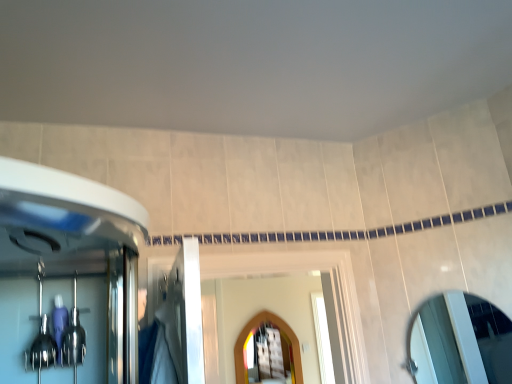
At what (x,y) coordinates should I click in order to perform the action: click on wooden arched mirror at center, arranged as the first mirror when viewed from the back. Please return your answer as a coordinate pair (x, y). The image size is (512, 384). Looking at the image, I should click on (255, 329).

What is the approximate height of wooden arched mirror at center, the 1th mirror viewed from the left?

The height of wooden arched mirror at center, the 1th mirror viewed from the left, is 87.25 centimeters.

The image size is (512, 384). What do you see at coordinates (255, 329) in the screenshot? I see `wooden arched mirror at center, which appears as the first mirror when ordered from the bottom` at bounding box center [255, 329].

In order to face silver metallic mirror at right, the 2th mirror viewed from the left, should I rotate leftwards or rightwards?

You should look right and rotate roughly 25.393 degrees.

Find the location of `silver metallic mirror at right, the 1th mirror in the front-to-back sequence`. silver metallic mirror at right, the 1th mirror in the front-to-back sequence is located at coordinates (460, 342).

What is the approximate width of silver metallic mirror at right, which is the 1th mirror in top-to-bottom order?

The width of silver metallic mirror at right, which is the 1th mirror in top-to-bottom order, is 3.56 inches.

Describe the element at coordinates (460, 342) in the screenshot. I see `silver metallic mirror at right, marked as the second mirror in a back-to-front arrangement` at that location.

Where is `wooden arched mirror at center, which is the second mirror from front to back`? wooden arched mirror at center, which is the second mirror from front to back is located at coordinates (255, 329).

Looking at this image, is silver metallic mirror at right, the 2th mirror viewed from the left, to the right of wooden arched mirror at center, the second mirror from the top, from the viewer's perspective?

Indeed, silver metallic mirror at right, the 2th mirror viewed from the left, is positioned on the right side of wooden arched mirror at center, the second mirror from the top.

Is the depth of silver metallic mirror at right, which ranks as the 2th mirror in bottom-to-top order, greater than that of wooden arched mirror at center, the 2th mirror from the right?

No, silver metallic mirror at right, which ranks as the 2th mirror in bottom-to-top order, is closer to the camera.

Does point (422, 356) appear closer or farther from the camera than point (247, 335)?

Clearly, point (422, 356) is closer to the camera than point (247, 335).

From the image's perspective, who appears lower, silver metallic mirror at right, marked as the second mirror in a back-to-front arrangement, or wooden arched mirror at center, the second mirror from the top?

wooden arched mirror at center, the second mirror from the top, appears lower in the image.

From a real-world perspective, is silver metallic mirror at right, which ranks as the 2th mirror in bottom-to-top order, above or below wooden arched mirror at center, which appears as the first mirror when ordered from the bottom?

Clearly, from a real-world perspective, silver metallic mirror at right, which ranks as the 2th mirror in bottom-to-top order, is above wooden arched mirror at center, which appears as the first mirror when ordered from the bottom.

Can you confirm if silver metallic mirror at right, the 1th mirror in the front-to-back sequence, is wider than wooden arched mirror at center, the 1th mirror viewed from the left?

Indeed, silver metallic mirror at right, the 1th mirror in the front-to-back sequence, has a greater width compared to wooden arched mirror at center, the 1th mirror viewed from the left.

Does silver metallic mirror at right, the 2th mirror viewed from the left, have a greater height compared to wooden arched mirror at center, the second mirror from the top?

No.

In terms of size, does silver metallic mirror at right, the 1th mirror in the front-to-back sequence, appear bigger or smaller than wooden arched mirror at center, the 1th mirror viewed from the left?

Clearly, silver metallic mirror at right, the 1th mirror in the front-to-back sequence, is smaller in size than wooden arched mirror at center, the 1th mirror viewed from the left.

Is silver metallic mirror at right, which ranks as the 2th mirror in bottom-to-top order, completely or partially outside of wooden arched mirror at center, the second mirror from the top?

Indeed, silver metallic mirror at right, which ranks as the 2th mirror in bottom-to-top order, is completely outside wooden arched mirror at center, the second mirror from the top.

Is silver metallic mirror at right, which is the 1th mirror in top-to-bottom order, placed right next to wooden arched mirror at center, which appears as the first mirror when ordered from the bottom?

No, silver metallic mirror at right, which is the 1th mirror in top-to-bottom order, is not making contact with wooden arched mirror at center, which appears as the first mirror when ordered from the bottom.

Is silver metallic mirror at right, marked as the second mirror in a back-to-front arrangement, oriented away from wooden arched mirror at center, arranged as the first mirror when viewed from the back?

No, wooden arched mirror at center, arranged as the first mirror when viewed from the back, is not at the back of silver metallic mirror at right, marked as the second mirror in a back-to-front arrangement.

What's the angular difference between silver metallic mirror at right, acting as the first mirror starting from the right, and wooden arched mirror at center, which appears as the first mirror when ordered from the bottom,'s facing directions?

The facing directions of silver metallic mirror at right, acting as the first mirror starting from the right, and wooden arched mirror at center, which appears as the first mirror when ordered from the bottom, are 55.3 degrees apart.

Where is `mirror that appears below the silver metallic mirror at right, the 1th mirror in the front-to-back sequence (from a real-world perspective)`? mirror that appears below the silver metallic mirror at right, the 1th mirror in the front-to-back sequence (from a real-world perspective) is located at coordinates (255, 329).

Which is more to the left, wooden arched mirror at center, the 2th mirror from the right, or silver metallic mirror at right, which is the 1th mirror in top-to-bottom order?

Positioned to the left is wooden arched mirror at center, the 2th mirror from the right.

Is wooden arched mirror at center, arranged as the first mirror when viewed from the back, in front of or behind silver metallic mirror at right, which ranks as the 2th mirror in bottom-to-top order, in the image?

wooden arched mirror at center, arranged as the first mirror when viewed from the back, is behind silver metallic mirror at right, which ranks as the 2th mirror in bottom-to-top order.

Is point (286, 325) positioned before point (483, 331)?

That is False.

In the scene shown: From the image's perspective, between wooden arched mirror at center, the 1th mirror viewed from the left, and silver metallic mirror at right, marked as the second mirror in a back-to-front arrangement, who is located below?

wooden arched mirror at center, the 1th mirror viewed from the left, appears lower in the image.

From a real-world perspective, between wooden arched mirror at center, the 2th mirror from the right, and silver metallic mirror at right, marked as the second mirror in a back-to-front arrangement, who is vertically higher?

silver metallic mirror at right, marked as the second mirror in a back-to-front arrangement.

Which object is wider, wooden arched mirror at center, which is the second mirror from front to back, or silver metallic mirror at right, which ranks as the 2th mirror in bottom-to-top order?

silver metallic mirror at right, which ranks as the 2th mirror in bottom-to-top order.

Looking at this image, from their relative heights in the image, would you say wooden arched mirror at center, which is the second mirror from front to back, is taller or shorter than silver metallic mirror at right, marked as the second mirror in a back-to-front arrangement?

In the image, wooden arched mirror at center, which is the second mirror from front to back, appears to be taller than silver metallic mirror at right, marked as the second mirror in a back-to-front arrangement.

Does wooden arched mirror at center, the 2th mirror from the right, have a smaller size compared to silver metallic mirror at right, the 2th mirror viewed from the left?

Actually, wooden arched mirror at center, the 2th mirror from the right, might be larger than silver metallic mirror at right, the 2th mirror viewed from the left.

Is wooden arched mirror at center, which appears as the first mirror when ordered from the bottom, positioned beyond the bounds of silver metallic mirror at right, marked as the second mirror in a back-to-front arrangement?

That's correct, wooden arched mirror at center, which appears as the first mirror when ordered from the bottom, is outside of silver metallic mirror at right, marked as the second mirror in a back-to-front arrangement.

Can you see wooden arched mirror at center, which is the second mirror from front to back, touching silver metallic mirror at right, the 2th mirror viewed from the left?

wooden arched mirror at center, which is the second mirror from front to back, is not next to silver metallic mirror at right, the 2th mirror viewed from the left, and they're not touching.

Could you tell me if wooden arched mirror at center, the second mirror from the top, is turned towards silver metallic mirror at right, the 1th mirror in the front-to-back sequence?

Yes, wooden arched mirror at center, the second mirror from the top, is aimed at silver metallic mirror at right, the 1th mirror in the front-to-back sequence.

How many degrees apart are the facing directions of wooden arched mirror at center, the second mirror from the top, and silver metallic mirror at right, the 1th mirror in the front-to-back sequence?

The facing directions of wooden arched mirror at center, the second mirror from the top, and silver metallic mirror at right, the 1th mirror in the front-to-back sequence, are 55.3 degrees apart.

Identify the location of mirror that appears behind the silver metallic mirror at right, which ranks as the 2th mirror in bottom-to-top order. (255, 329).

The height and width of the screenshot is (384, 512). What are the coordinates of `mirror that is in front of the wooden arched mirror at center, arranged as the first mirror when viewed from the back` in the screenshot? It's located at (460, 342).

Identify the location of mirror on the left of silver metallic mirror at right, the 1th mirror in the front-to-back sequence. (255, 329).